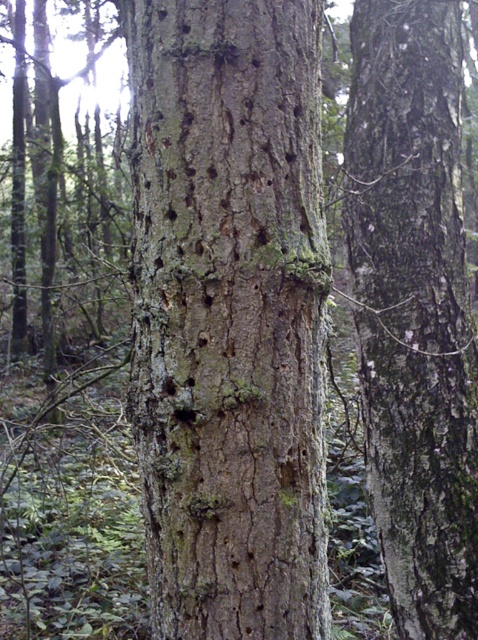
You are standing in a forest looking at a tree trunk with rough bark. There is a point marked at coordinates (x=229, y=314). Based on the description, what feature of the tree trunk does this point most likely indicate?

A: The point at (x=229, y=314) corresponds to the rough bark tree trunk at center.

You are a botanist examining the tree trunk. You notice two areas of bark on the same tree trunk at the center. One is labeled as rough bark tree trunk at center and the other as smooth brown bark at center. Which area is located lower on the trunk?

The rough bark tree trunk at center is located below the smooth brown bark at center, so the rough bark area is lower on the trunk.